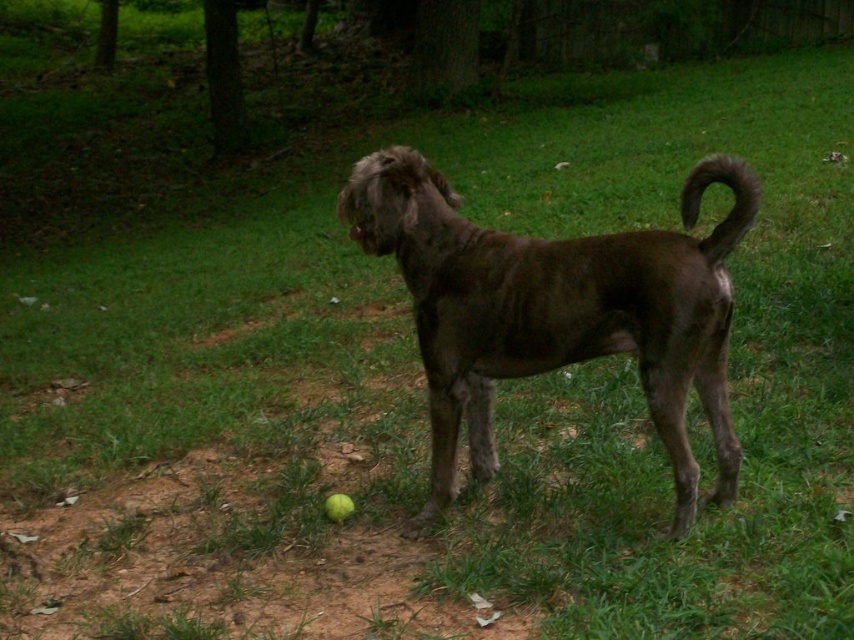
Does shiny brown fur at center appear under brown furry tail at right?

Yes.

Is point (566, 300) positioned before point (705, 256)?

That is False.

In order to click on shiny brown fur at center in this screenshot , I will do tap(556, 308).